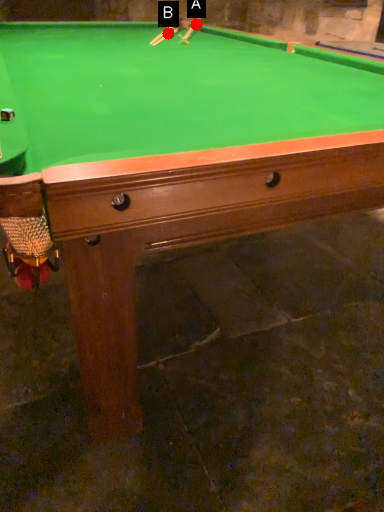
Question: Two points are circled on the image, labeled by A and B beside each circle. Which of the following is the farthest from the observer?

Choices:
 (A) A is further
 (B) B is further

Answer: (A)